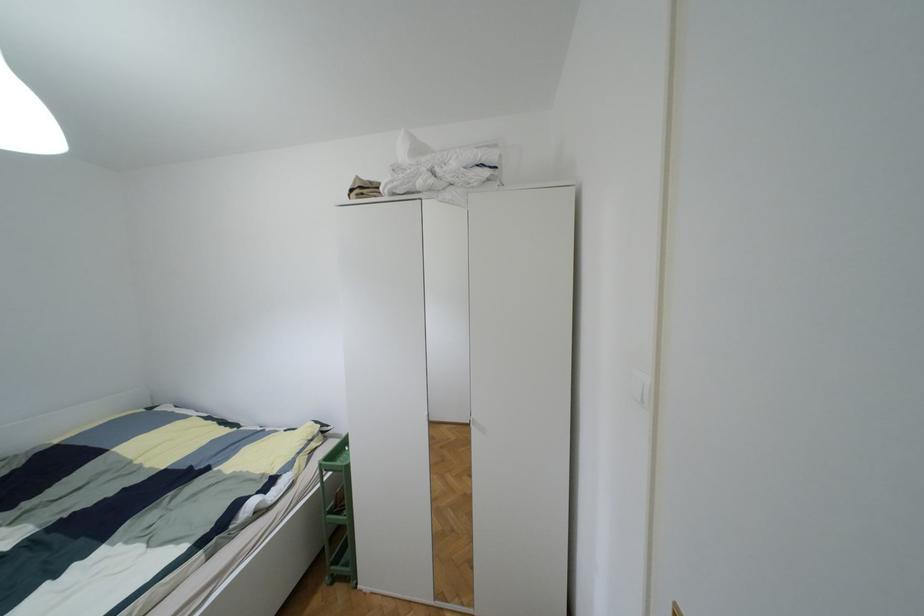
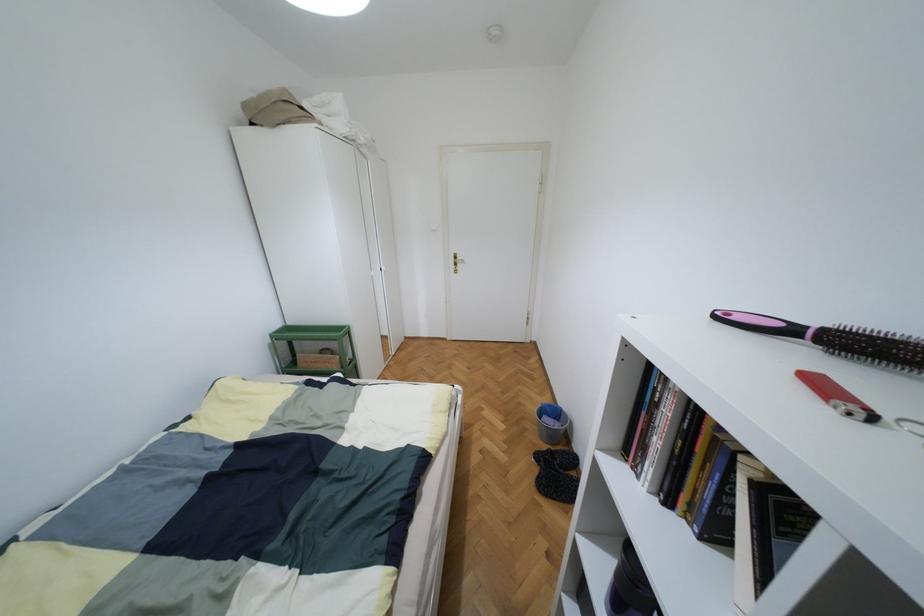
Question: I am providing you with two images of the same scene from different viewpoints. Which of the following objects are not visible in image2?

Choices:
 (A) gold door handle
 (B) colorful food box
 (C) silver wardrobe handle
 (D) green plastic cart

Answer: (D)